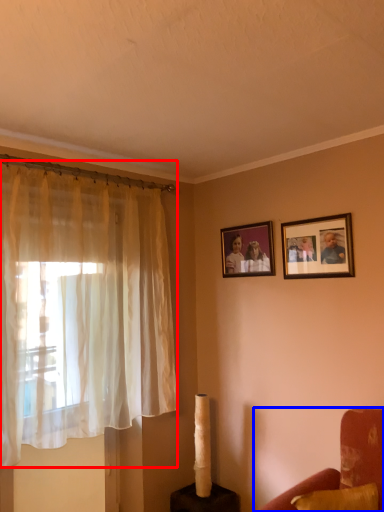
Question: Which point is further to the camera, curtain (highlighted by a red box) or furniture (highlighted by a blue box)?

Choices:
 (A) curtain
 (B) furniture

Answer: (A)